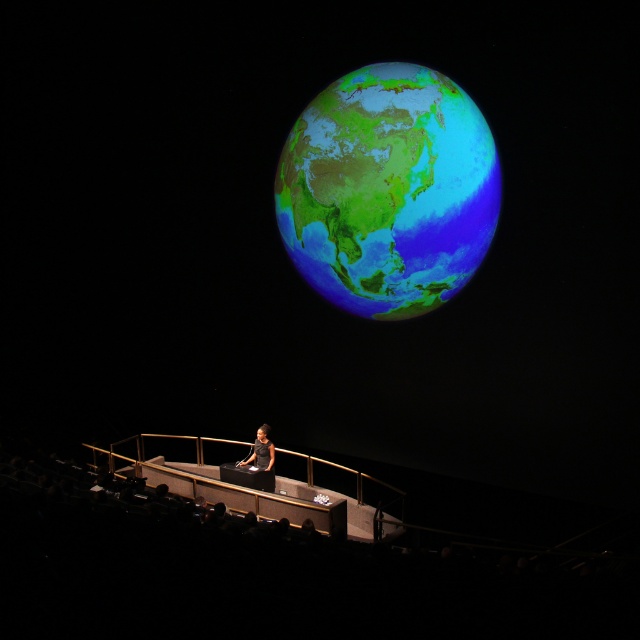
Question: Which of the following is the farthest from the observer?

Choices:
 (A) (250, 460)
 (B) (387, 305)

Answer: (A)

Question: Can you confirm if shiny metallic globe at upper center is positioned above black matte dress at center?

Choices:
 (A) yes
 (B) no

Answer: (A)

Question: Which point is farther to the camera?

Choices:
 (A) black matte dress at center
 (B) shiny metallic globe at upper center

Answer: (A)

Question: Which of the following is the farthest from the observer?

Choices:
 (A) black matte dress at center
 (B) shiny metallic globe at upper center

Answer: (A)

Question: Is shiny metallic globe at upper center to the left of black matte dress at center from the viewer's perspective?

Choices:
 (A) yes
 (B) no

Answer: (B)

Question: Is shiny metallic globe at upper center behind black matte dress at center?

Choices:
 (A) no
 (B) yes

Answer: (A)